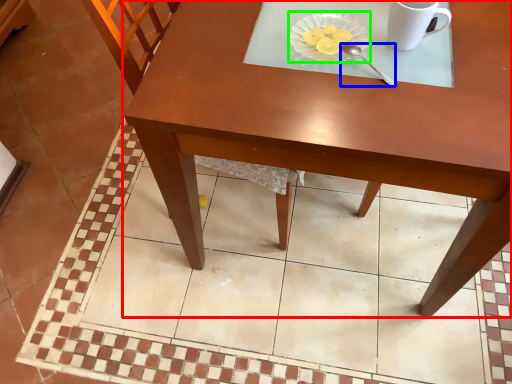
Question: Estimate the real-world distances between objects in this image. Which object is farther from table (highlighted by a red box), spoon (highlighted by a blue box) or glass plate (highlighted by a green box)?

Choices:
 (A) spoon
 (B) glass plate

Answer: (A)